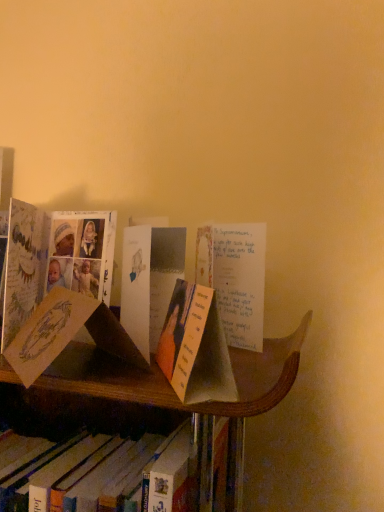
Locate an element on the screen. The image size is (384, 512). white paper bookmark at center, the second book from the right is located at coordinates (98, 473).

What do you see at coordinates (98, 473) in the screenshot? This screenshot has width=384, height=512. I see `white paper bookmark at center, which appears as the 1th book when ordered from the bottom` at bounding box center [98, 473].

Describe the element at coordinates (195, 347) in the screenshot. This screenshot has height=512, width=384. I see `orange paper bookmark at center, which appears as the 1th book when viewed from the right` at that location.

This screenshot has width=384, height=512. Identify the location of orange paper bookmark at center, the first book positioned from the top. (195, 347).

Measure the distance between point (x=202, y=382) and camera.

Point (x=202, y=382) and camera are 16.10 inches apart.

Image resolution: width=384 pixels, height=512 pixels. I want to click on white paper bookmark at center, the second book from the right, so click(x=98, y=473).

Considering the positions of objects white paper bookmark at center, marked as the 2th book in a top-to-bottom arrangement, and orange paper bookmark at center, the first book positioned from the top, in the image provided, who is more to the left, white paper bookmark at center, marked as the 2th book in a top-to-bottom arrangement, or orange paper bookmark at center, the first book positioned from the top,?

Positioned to the left is white paper bookmark at center, marked as the 2th book in a top-to-bottom arrangement.

Is white paper bookmark at center, which appears as the 1th book when ordered from the bottom, in front of orange paper bookmark at center, the second book in the bottom-to-top sequence?

No, the depth of white paper bookmark at center, which appears as the 1th book when ordered from the bottom, is greater than that of orange paper bookmark at center, the second book in the bottom-to-top sequence.

Is point (11, 481) positioned before point (177, 388)?

No, (11, 481) is behind (177, 388).

From the picture: From the image's perspective, who appears lower, white paper bookmark at center, which appears as the 1th book when ordered from the bottom, or orange paper bookmark at center, the 2th book from the left?

white paper bookmark at center, which appears as the 1th book when ordered from the bottom, is shown below in the image.

From a real-world perspective, is white paper bookmark at center, the second book from the right, above or below orange paper bookmark at center, the first book positioned from the top?

white paper bookmark at center, the second book from the right, is below orange paper bookmark at center, the first book positioned from the top.

Considering the relative sizes of white paper bookmark at center, marked as the 2th book in a top-to-bottom arrangement, and orange paper bookmark at center, the second book in the bottom-to-top sequence, in the image provided, is white paper bookmark at center, marked as the 2th book in a top-to-bottom arrangement, wider than orange paper bookmark at center, the second book in the bottom-to-top sequence,?

Yes.

Can you confirm if white paper bookmark at center, which appears as the 1th book when ordered from the bottom, is shorter than orange paper bookmark at center, the 2th book from the left?

Incorrect, the height of white paper bookmark at center, which appears as the 1th book when ordered from the bottom, does not fall short of that of orange paper bookmark at center, the 2th book from the left.

Considering the relative sizes of white paper bookmark at center, the second book from the right, and orange paper bookmark at center, the first book positioned from the top, in the image provided, is white paper bookmark at center, the second book from the right, smaller than orange paper bookmark at center, the first book positioned from the top,?

Actually, white paper bookmark at center, the second book from the right, might be larger than orange paper bookmark at center, the first book positioned from the top.

Is white paper bookmark at center, positioned as the first book in left-to-right order, outside of orange paper bookmark at center, the second book in the bottom-to-top sequence?

Yes, white paper bookmark at center, positioned as the first book in left-to-right order, is not within orange paper bookmark at center, the second book in the bottom-to-top sequence.

Would you consider white paper bookmark at center, positioned as the first book in left-to-right order, to be distant from orange paper bookmark at center, the second book in the bottom-to-top sequence?

That's not correct — white paper bookmark at center, positioned as the first book in left-to-right order, is a little close to orange paper bookmark at center, the second book in the bottom-to-top sequence.

Is white paper bookmark at center, positioned as the first book in left-to-right order, facing away from orange paper bookmark at center, the second book in the bottom-to-top sequence?

No.

How distant is white paper bookmark at center, marked as the 2th book in a top-to-bottom arrangement, from orange paper bookmark at center, the 2th book from the left?

A distance of 7.13 inches exists between white paper bookmark at center, marked as the 2th book in a top-to-bottom arrangement, and orange paper bookmark at center, the 2th book from the left.

Identify the location of book below the orange paper bookmark at center, the 2th book from the left (from the image's perspective). (98, 473).

Is orange paper bookmark at center, the 2th book from the left, to the right of white paper bookmark at center, which appears as the 1th book when ordered from the bottom, from the viewer's perspective?

Indeed, orange paper bookmark at center, the 2th book from the left, is positioned on the right side of white paper bookmark at center, which appears as the 1th book when ordered from the bottom.

Considering their positions, is orange paper bookmark at center, the first book positioned from the top, located in front of or behind white paper bookmark at center, which appears as the 1th book when ordered from the bottom?

orange paper bookmark at center, the first book positioned from the top, is positioned closer to the viewer than white paper bookmark at center, which appears as the 1th book when ordered from the bottom.

Does point (190, 404) come farther from viewer compared to point (226, 443)?

No, it is not.

From the image's perspective, between orange paper bookmark at center, the first book positioned from the top, and white paper bookmark at center, the second book from the right, which one is located above?

orange paper bookmark at center, the first book positioned from the top.

From a real-world perspective, does orange paper bookmark at center, the 2th book from the left, sit lower than white paper bookmark at center, which appears as the 1th book when ordered from the bottom?

No.

Is orange paper bookmark at center, the first book positioned from the top, thinner than white paper bookmark at center, the second book from the right?

Correct, the width of orange paper bookmark at center, the first book positioned from the top, is less than that of white paper bookmark at center, the second book from the right.

From their relative heights in the image, would you say orange paper bookmark at center, the 2th book from the left, is taller or shorter than white paper bookmark at center, marked as the 2th book in a top-to-bottom arrangement?

Considering their sizes, orange paper bookmark at center, the 2th book from the left, has less height than white paper bookmark at center, marked as the 2th book in a top-to-bottom arrangement.

Which of these two, orange paper bookmark at center, the first book positioned from the top, or white paper bookmark at center, positioned as the first book in left-to-right order, is smaller?

orange paper bookmark at center, the first book positioned from the top, is smaller.

Can we say orange paper bookmark at center, which appears as the 1th book when viewed from the right, lies outside white paper bookmark at center, the second book from the right?

Yes, orange paper bookmark at center, which appears as the 1th book when viewed from the right, is not within white paper bookmark at center, the second book from the right.

Is orange paper bookmark at center, which appears as the 1th book when viewed from the right, far from white paper bookmark at center, which appears as the 1th book when ordered from the bottom?

No, there isn't a large distance between orange paper bookmark at center, which appears as the 1th book when viewed from the right, and white paper bookmark at center, which appears as the 1th book when ordered from the bottom.

Could you tell me if orange paper bookmark at center, the first book positioned from the top, is turned towards white paper bookmark at center, marked as the 2th book in a top-to-bottom arrangement?

No, orange paper bookmark at center, the first book positioned from the top, is not facing towards white paper bookmark at center, marked as the 2th book in a top-to-bottom arrangement.

Can you tell me how much orange paper bookmark at center, the second book in the bottom-to-top sequence, and white paper bookmark at center, the second book from the right, differ in facing direction?

They differ by 66.3 degrees in their facing directions.

The height and width of the screenshot is (512, 384). In order to click on book lying above the white paper bookmark at center, positioned as the first book in left-to-right order (from the image's perspective) in this screenshot , I will do `click(195, 347)`.

Identify the location of book to the left of orange paper bookmark at center, the second book in the bottom-to-top sequence. The image size is (384, 512). (98, 473).

Where is `book on the right of white paper bookmark at center, marked as the 2th book in a top-to-bottom arrangement`? book on the right of white paper bookmark at center, marked as the 2th book in a top-to-bottom arrangement is located at coordinates [195, 347].